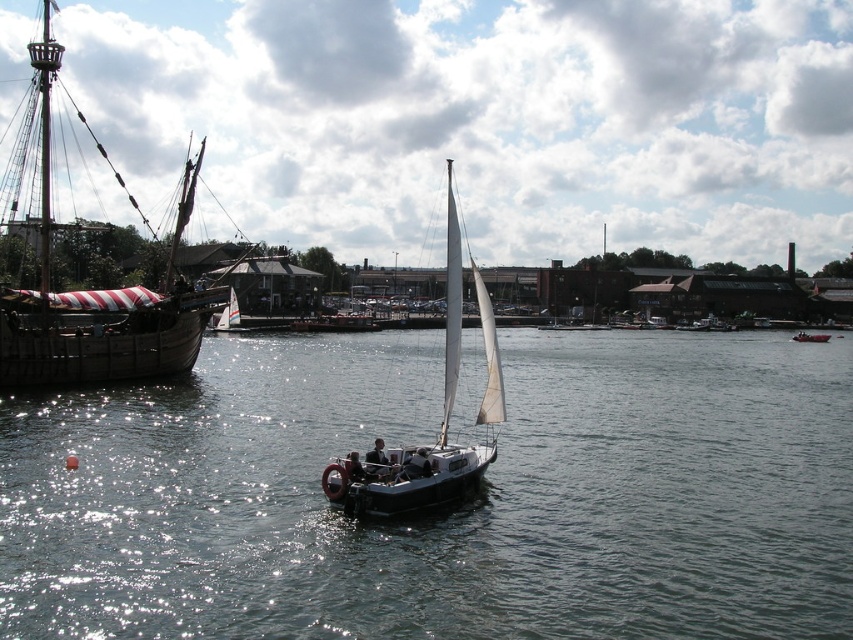
You are a photographer planning to take a photo of the wooden ship at left and the white sailboat at center. Which one should you focus on first if you want to capture the tallest object in the scene?

The wooden ship at left is taller than the white sailboat at center, so you should focus on the wooden ship at left first to capture the tallest object in the scene.

You are a photographer planning to take a picture of the wooden ship at left and the red plastic boat at center. Based on their positions, which object should you focus on first to ensure both are in the frame?

The wooden ship at left is above the red plastic boat at center, so you should focus on the wooden ship at left first to ensure both are in the frame.